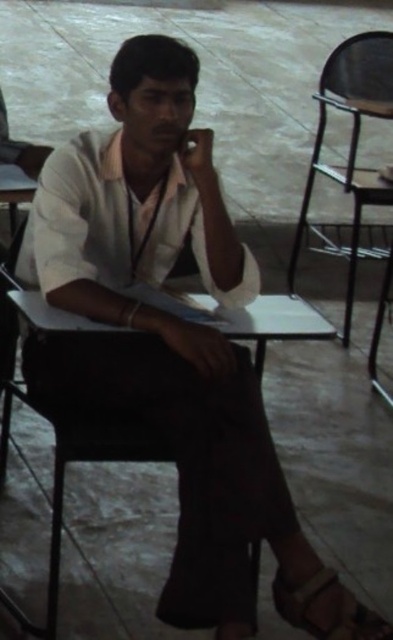
What do you see at coordinates (350, 156) in the screenshot? I see `metallic black chair at right` at bounding box center [350, 156].

Is metallic black chair at right shorter than brown leather sandal at lower right?

Incorrect, metallic black chair at right's height does not fall short of brown leather sandal at lower right's.

Between point (354, 244) and point (345, 611), which one is positioned in front?

Point (345, 611)

Identify the location of metallic black chair at right. This screenshot has height=640, width=393. (350, 156).